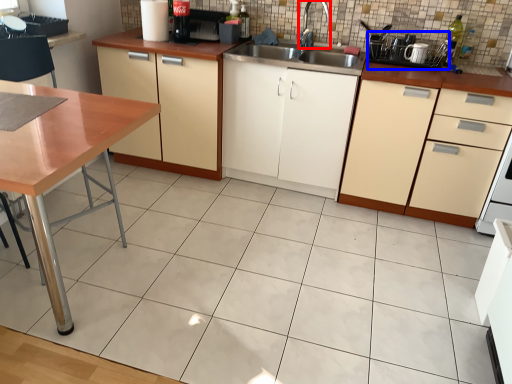
Question: Which point is closer to the camera, faucet (highlighted by a red box) or appliance (highlighted by a blue box)?

Choices:
 (A) faucet
 (B) appliance

Answer: (B)